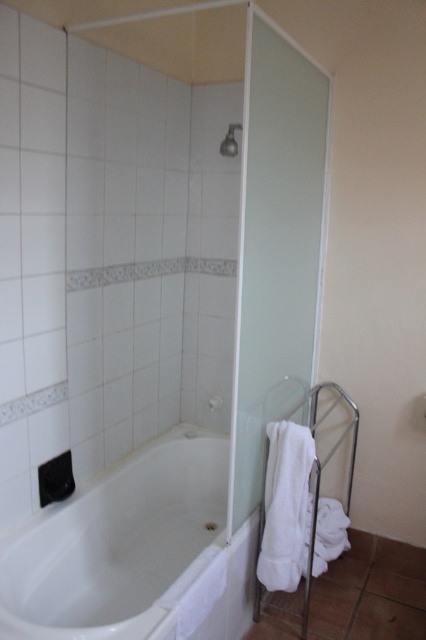
You are standing in the bathroom and want to enter the shower area. The entrance is behind the transparent frosted glass door at right. To locate it, where should you look relative to the satin silver faucet at upper center?

The transparent frosted glass door at right is to the right of the satin silver faucet at upper center, so you should look to the right side of the satin silver faucet at upper center to find the entrance to the shower area.

You are designing a bathroom layout and need to ensure that the transparent frosted glass door at right and the satin silver faucet at upper center are spaced appropriately. Given their sizes, which object should be placed farther from the wall to avoid overcrowding the space?

The transparent frosted glass door at right is larger in size than the satin silver faucet at upper center, so it should be placed farther from the wall to accommodate its size and prevent overcrowding.

Based on the photo, you are a plumber inspecting the bathroom and need to locate the main water supply for the satin silver faucet at upper center. Based on the scene, where would you expect to find the main water supply relative to the white glossy bathtub at lower left?

The white glossy bathtub at lower left is positioned under the satin silver faucet at upper center, so the main water supply for the satin silver faucet at upper center would likely be located above the white glossy bathtub at lower left.